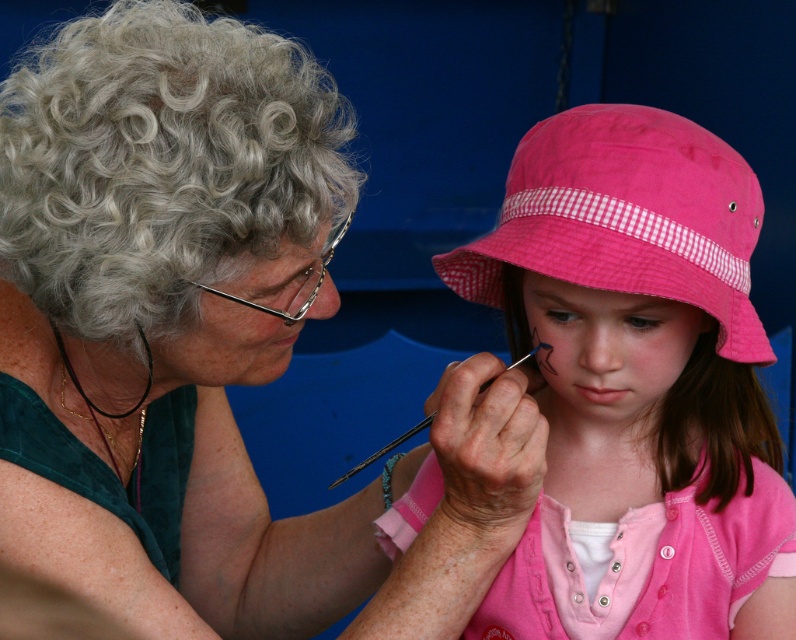
Question: Based on their relative distances, which object is farther from the pink fabric hat at upper right?

Choices:
 (A) matte green blouse at center
 (B) pink cotton hat at upper right

Answer: (A)

Question: Is matte green blouse at center wider than pink fabric hat at upper right?

Choices:
 (A) yes
 (B) no

Answer: (A)

Question: Can you confirm if matte green blouse at center is thinner than pink cotton hat at upper right?

Choices:
 (A) yes
 (B) no

Answer: (B)

Question: Which of the following is the farthest from the observer?

Choices:
 (A) (718, 515)
 (B) (580, 284)
 (C) (302, 147)

Answer: (A)

Question: Is matte green blouse at center wider than pink cotton hat at upper right?

Choices:
 (A) no
 (B) yes

Answer: (B)

Question: Which object is farther from the camera taking this photo?

Choices:
 (A) matte green blouse at center
 (B) pink fabric hat at upper right
 (C) pink cotton hat at upper right

Answer: (B)